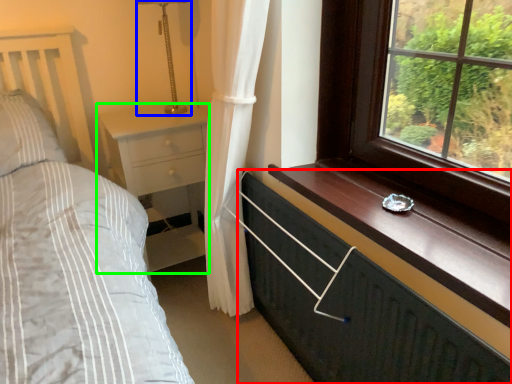
Question: Based on their relative distances, which object is farther from chest of drawers (highlighted by a red box)? Choose from table lamp (highlighted by a blue box) and nightstand (highlighted by a green box).

Choices:
 (A) table lamp
 (B) nightstand

Answer: (A)